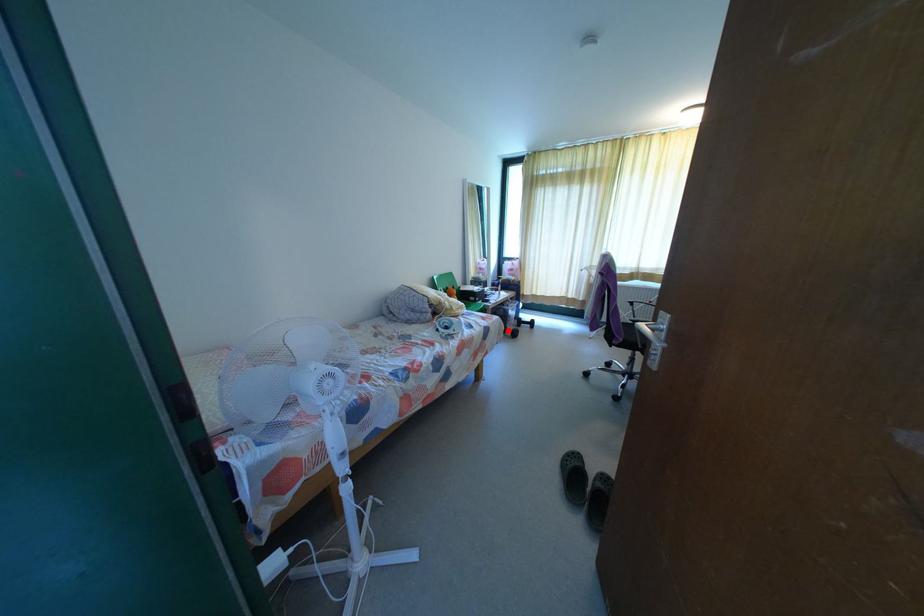
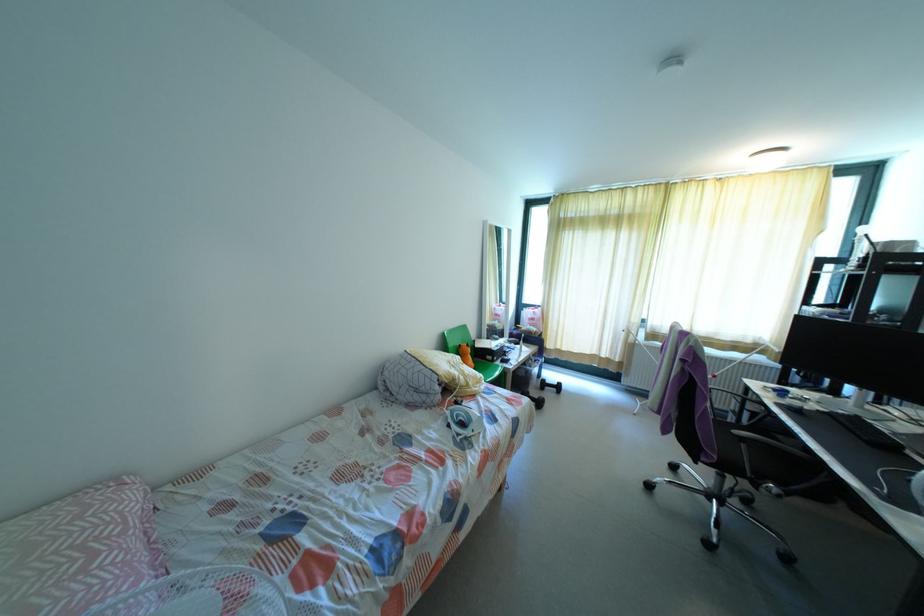
Where in the second image is the point corresponding to the highlighted location from the first image?

(531, 399)